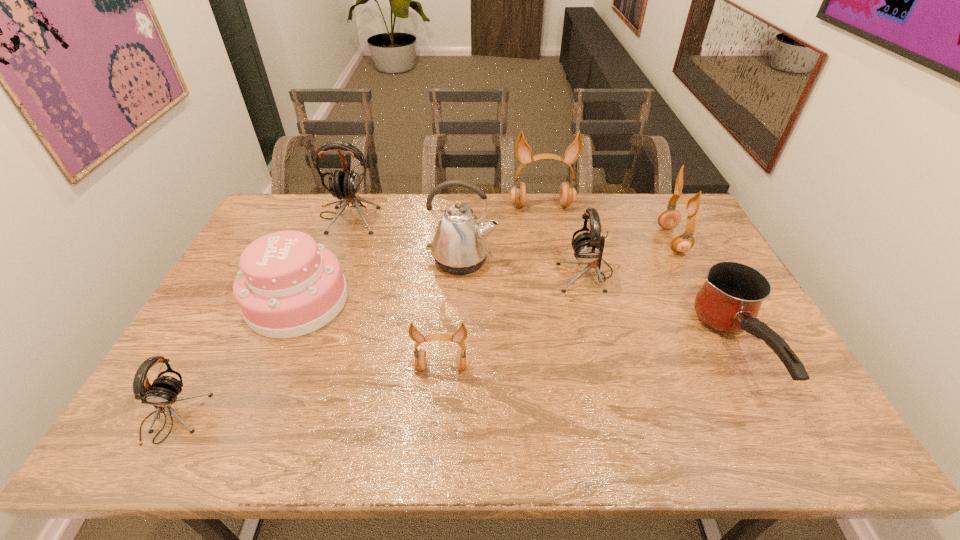
You are a GUI agent. You are given a task and a screenshot of the screen. Output one action in this format:
    pyautogui.click(x=<x>, y=<y>)
    Task: Click on the saucepan that is at the right edge
    The width and height of the screenshot is (960, 540).
    Given the screenshot: What is the action you would take?
    pyautogui.click(x=729, y=301)

This screenshot has height=540, width=960. In order to click on object present at the near left corner in this screenshot , I will do `click(163, 392)`.

The image size is (960, 540). What are the coordinates of `object at the far right corner` in the screenshot? It's located at (670, 218).

Where is `object that is at the near right corner`? This screenshot has height=540, width=960. object that is at the near right corner is located at coordinates (729, 301).

You are a GUI agent. You are given a task and a screenshot of the screen. Output one action in this format:
    pyautogui.click(x=<x>, y=<y>)
    Task: Click on the free space at the far edge
    
    Given the screenshot: What is the action you would take?
    pyautogui.click(x=364, y=204)

The height and width of the screenshot is (540, 960). I want to click on blank space at the near edge of the desktop, so click(x=330, y=429).

Find the location of `blank space at the left edge of the desktop`. blank space at the left edge of the desktop is located at coordinates (222, 336).

The height and width of the screenshot is (540, 960). In order to click on blank space at the far right corner in this screenshot , I will do `click(682, 232)`.

You are a GUI agent. You are given a task and a screenshot of the screen. Output one action in this format:
    pyautogui.click(x=<x>, y=<y>)
    Task: Click on the free point between the leftmost black earphone and the saucepan
    This screenshot has width=960, height=540.
    Given the screenshot: What is the action you would take?
    pyautogui.click(x=454, y=384)

Find the location of a particular element. free area in between the leftmost brown earphone and the saucepan is located at coordinates (588, 359).